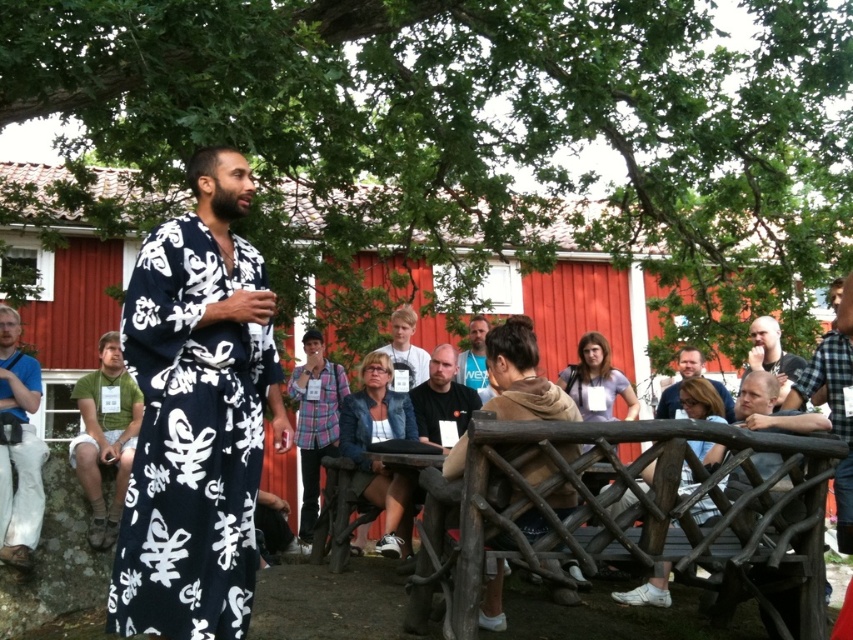
You are attending an outdoor event under a large tree and see two items of clothing in the scene. The first is a checkered fabric shirt at right, and the second is a white printed fabric at center. From your perspective, which clothing item is positioned more to the right?

The checkered fabric shirt at right is positioned more to the right than the white printed fabric at center.

You are a photographer at the event and want to capture a photo of the two people wearing the plaid fabric shirt at center and the black matte shirt at center. Which one should you focus on first if you want to include both in the frame without moving the camera?

The plaid fabric shirt at center is located below the black matte shirt at center, so you should focus on the black matte shirt at center first to ensure both are in the frame.

You are a photographer at the event and need to capture a photo that includes both the plaid fabric shirt at center and the smooth brown leather jacket at lower right. Based on their positions, which one should you focus on first to ensure both are in the frame?

The plaid fabric shirt at center is positioned on the left side of smooth brown leather jacket at lower right, so you should focus on the plaid fabric shirt at center first to ensure both are in the frame.